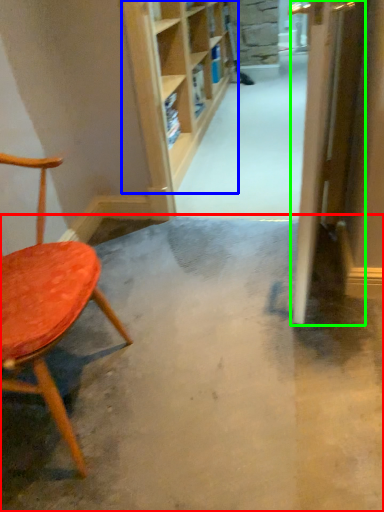
Question: Based on their relative distances, which object is farther from concrete (highlighted by a red box)? Choose from shelf (highlighted by a blue box) and door (highlighted by a green box).

Choices:
 (A) shelf
 (B) door

Answer: (A)